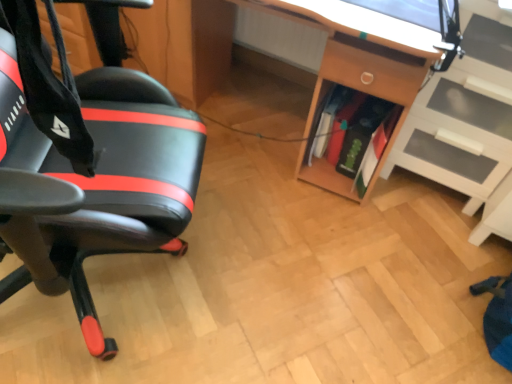
Locate an element on the screen. wooden desk at center is located at coordinates (361, 54).

What is the approximate height of white glossy shelf at right?

31.46 inches.

The width and height of the screenshot is (512, 384). Describe the element at coordinates (376, 150) in the screenshot. I see `green matte book at center, the 3th book from the back` at that location.

Locate an element on the screen. This screenshot has height=384, width=512. green matte book at center, which appears as the first book when viewed from the back is located at coordinates (342, 126).

At what (x,y) coordinates should I click in order to perform the action: click on green matte book at center, which is the second book in front-to-back order. Please return your answer as a coordinate pair (x, y). This screenshot has width=512, height=384. Looking at the image, I should click on (366, 140).

Image resolution: width=512 pixels, height=384 pixels. Describe the element at coordinates (366, 140) in the screenshot. I see `green matte book at center, which is the second book in front-to-back order` at that location.

Where is `wooden desk at center`? wooden desk at center is located at coordinates (361, 54).

Is wooden desk at center facing away from green matte book at center, which is the second book in front-to-back order?

wooden desk at center does not have its back to green matte book at center, which is the second book in front-to-back order.

Between wooden desk at center and green matte book at center, which ranks as the 2th book in back-to-front order, which one has smaller size?

green matte book at center, which ranks as the 2th book in back-to-front order, is smaller.

Between wooden desk at center and green matte book at center, which ranks as the 2th book in back-to-front order, which one is positioned behind?

green matte book at center, which ranks as the 2th book in back-to-front order, is further away from the camera.

From the image's perspective, which is above, wooden desk at center or green matte book at center, which ranks as the 2th book in back-to-front order?

wooden desk at center, from the image's perspective.

What's the angular difference between wooden desk at center and black leather chair at left's facing directions?

112 degrees separate the facing orientations of wooden desk at center and black leather chair at left.

Is wooden desk at center in contact with black leather chair at left?

No, wooden desk at center is not next to black leather chair at left.

Consider the image. Is wooden desk at center inside or outside of black leather chair at left?

wooden desk at center cannot be found inside black leather chair at left.

Is wooden desk at center looking in the opposite direction of black leather chair at left?

wooden desk at center does not have its back to black leather chair at left.

Looking at the image, does green matte book at center, which is the second book in front-to-back order, seem bigger or smaller compared to green matte book at center, which appears as the first book when viewed from the back?

In the image, green matte book at center, which is the second book in front-to-back order, appears to be larger than green matte book at center, which appears as the first book when viewed from the back.

Is green matte book at center, which ranks as the 2th book in back-to-front order, at the right side of green matte book at center, which appears as the first book when viewed from the back?

Yes.

Can you confirm if green matte book at center, which ranks as the 2th book in back-to-front order, is taller than green matte book at center, placed as the 3th book when sorted from front to back?

Yes, green matte book at center, which ranks as the 2th book in back-to-front order, is taller than green matte book at center, placed as the 3th book when sorted from front to back.

What are the coordinates of `book behind the green matte book at center, which is the second book in front-to-back order` in the screenshot? It's located at (342, 126).

Which is in front, point (329, 159) or point (361, 134)?

Positioned in front is point (361, 134).

Is green matte book at center, placed as the 3th book when sorted from front to back, bigger or smaller than green matte book at center, which ranks as the 2th book in back-to-front order?

Clearly, green matte book at center, placed as the 3th book when sorted from front to back, is smaller in size than green matte book at center, which ranks as the 2th book in back-to-front order.

From a real-world perspective, is green matte book at center, placed as the 3th book when sorted from front to back, positioned above or below green matte book at center, which ranks as the 2th book in back-to-front order?

From a real-world perspective, green matte book at center, placed as the 3th book when sorted from front to back, is physically above green matte book at center, which ranks as the 2th book in back-to-front order.

In the scene shown: Are green matte book at center, which appears as the first book when viewed from the back, and green matte book at center, which ranks as the 2th book in back-to-front order, located far from each other?

They are positioned close to each other.

From the picture: In the image, is black leather chair at left positioned in front of or behind green matte book at center, placed as the 3th book when sorted from front to back?

black leather chair at left is positioned closer to the viewer than green matte book at center, placed as the 3th book when sorted from front to back.

Between point (172, 207) and point (340, 131), which one is positioned in front?

Point (172, 207)

From the image's perspective, is black leather chair at left located above green matte book at center, placed as the 3th book when sorted from front to back?

No.

Is black leather chair at left located outside green matte book at center, which appears as the first book when viewed from the back?

Yes, black leather chair at left is located beyond the bounds of green matte book at center, which appears as the first book when viewed from the back.

Between green matte book at center, which is the second book in front-to-back order, and wooden desk at center, which one has less height?

green matte book at center, which is the second book in front-to-back order.

Which of these two, green matte book at center, which ranks as the 2th book in back-to-front order, or wooden desk at center, is smaller?

green matte book at center, which ranks as the 2th book in back-to-front order, is smaller.

Is green matte book at center, which is the second book in front-to-back order, oriented towards wooden desk at center?

Yes, green matte book at center, which is the second book in front-to-back order, is turned towards wooden desk at center.

Can you confirm if green matte book at center, which is the second book in front-to-back order, is positioned to the right of wooden desk at center?

Indeed, green matte book at center, which is the second book in front-to-back order, is positioned on the right side of wooden desk at center.

What's the angular difference between green matte book at center, the 3th book from the back, and white glossy shelf at right's facing directions?

The angular difference between green matte book at center, the 3th book from the back, and white glossy shelf at right is 3.22 degrees.

From a real-world perspective, who is located higher, green matte book at center, the 3th book from the back, or white glossy shelf at right?

white glossy shelf at right is physically above.

From the image's perspective, who appears lower, green matte book at center, acting as the first book starting from the front, or white glossy shelf at right?

green matte book at center, acting as the first book starting from the front, from the image's perspective.

Is green matte book at center, acting as the first book starting from the front, oriented towards white glossy shelf at right?

No.

From the image's perspective, count 2nd books downward from the wooden desk at center and point to it. Please provide its 2D coordinates.

[(366, 140)]

Where is `chair above the wooden desk at center (from a real-world perspective)`? chair above the wooden desk at center (from a real-world perspective) is located at coordinates (109, 175).

Looking at this image, considering their positions, is green matte book at center, placed as the 3th book when sorted from front to back, positioned further to white glossy shelf at right than green matte book at center, which ranks as the 2th book in back-to-front order?

green matte book at center, placed as the 3th book when sorted from front to back, is further to white glossy shelf at right.

From the image, which object appears to be nearer to green matte book at center, placed as the 3th book when sorted from front to back, white glossy shelf at right or wooden desk at center?

wooden desk at center is closer to green matte book at center, placed as the 3th book when sorted from front to back.

Looking at the image, which one is located closer to green matte book at center, which appears as the first book when viewed from the back, black leather chair at left or white glossy shelf at right?

white glossy shelf at right is closer to green matte book at center, which appears as the first book when viewed from the back.

Looking at the image, which one is located further to black leather chair at left, wooden desk at center or green matte book at center, placed as the 3th book when sorted from front to back?

green matte book at center, placed as the 3th book when sorted from front to back, is positioned further to the anchor black leather chair at left.

Looking at this image, from the image, which object appears to be nearer to white glossy shelf at right, green matte book at center, which appears as the first book when viewed from the back, or wooden desk at center?

Among the two, wooden desk at center is located nearer to white glossy shelf at right.

Based on their spatial positions, is green matte book at center, which appears as the first book when viewed from the back, or wooden desk at center closer to green matte book at center, acting as the first book starting from the front?

The object closer to green matte book at center, acting as the first book starting from the front, is green matte book at center, which appears as the first book when viewed from the back.

Looking at this image, from the image, which object appears to be farther from wooden desk at center, green matte book at center, which appears as the first book when viewed from the back, or black leather chair at left?

The object further to wooden desk at center is black leather chair at left.

From the image, which object appears to be farther from green matte book at center, which ranks as the 2th book in back-to-front order, green matte book at center, placed as the 3th book when sorted from front to back, or wooden desk at center?

wooden desk at center is positioned further to the anchor green matte book at center, which ranks as the 2th book in back-to-front order.

This screenshot has width=512, height=384. I want to click on book between green matte book at center, acting as the first book starting from the front, and green matte book at center, placed as the 3th book when sorted from front to back, along the z-axis, so click(x=366, y=140).

In order to click on desk located between black leather chair at left and white glossy shelf at right in the left-right direction in this screenshot , I will do `click(361, 54)`.

This screenshot has height=384, width=512. I want to click on desk between black leather chair at left and green matte book at center, the 3th book from the back, along the z-axis, so click(x=361, y=54).

I want to click on book positioned between white glossy shelf at right and green matte book at center, which is the second book in front-to-back order, from near to far, so click(376, 150).